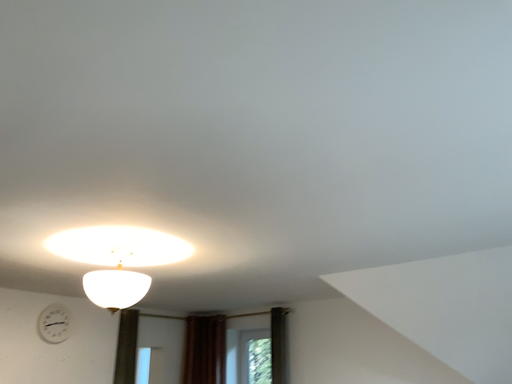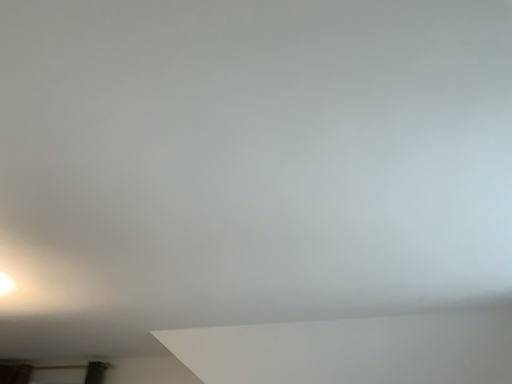
Question: How did the camera likely rotate when shooting the video?

Choices:
 (A) rotated left
 (B) rotated right

Answer: (B)